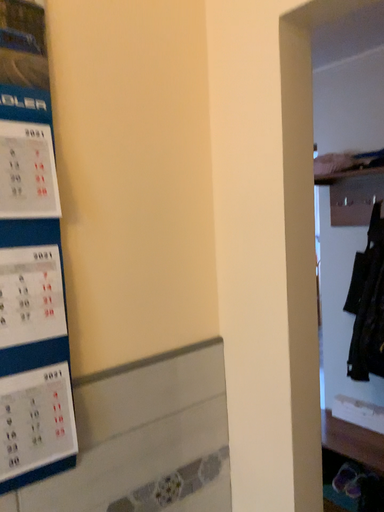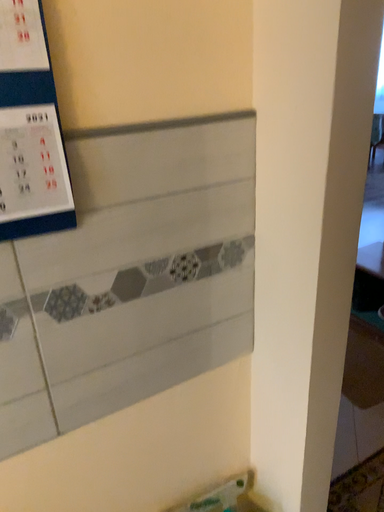
Question: Which way did the camera rotate in the video?

Choices:
 (A) rotated right
 (B) rotated left

Answer: (B)